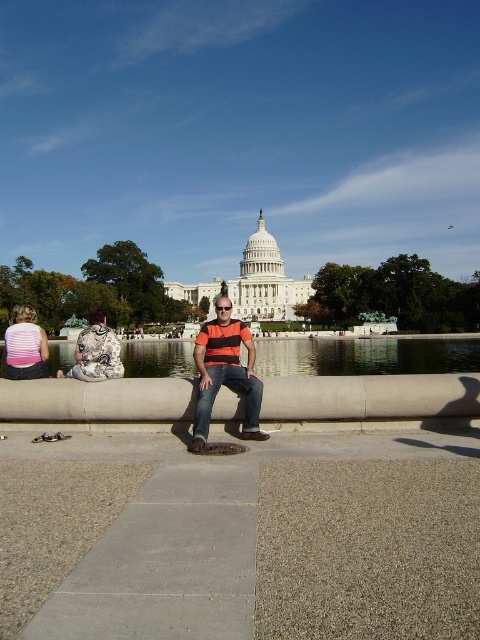
Question: Is clear glass water at center wider than orange striped shirt at center?

Choices:
 (A) no
 (B) yes

Answer: (B)

Question: Which point is farther to the camera?

Choices:
 (A) clear glass water at center
 (B) orange striped shirt at center

Answer: (A)

Question: Which object is farther from the camera taking this photo?

Choices:
 (A) orange striped shirt at center
 (B) clear glass water at center

Answer: (B)

Question: Does clear glass water at center have a smaller size compared to orange striped shirt at center?

Choices:
 (A) no
 (B) yes

Answer: (B)

Question: Does clear glass water at center appear on the right side of orange striped shirt at center?

Choices:
 (A) no
 (B) yes

Answer: (B)